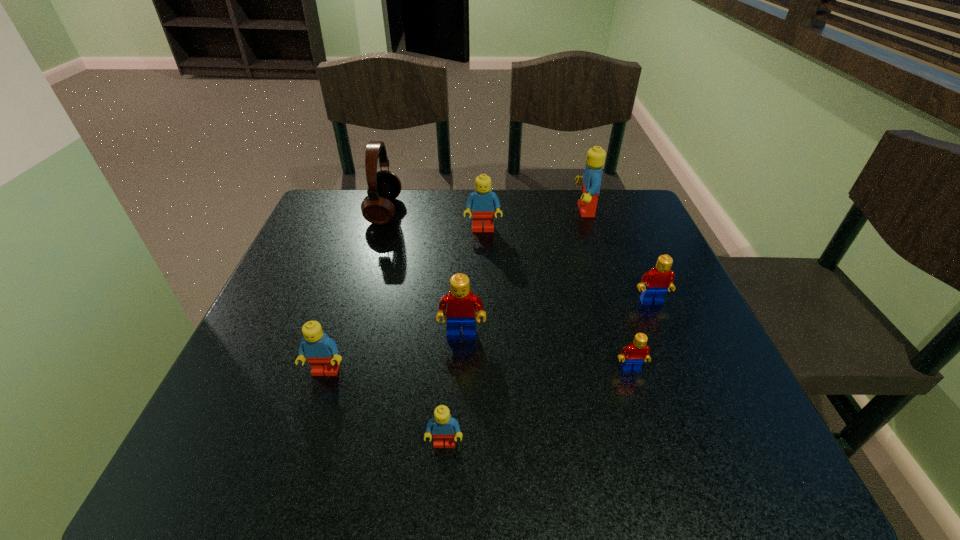
Find the location of a particular element. The height and width of the screenshot is (540, 960). the fifth nearest Lego is located at coordinates (660, 278).

Locate an element on the screen. This screenshot has width=960, height=540. the nearest red Lego is located at coordinates (632, 356).

In order to click on the smallest red Lego in this screenshot , I will do `click(632, 356)`.

Identify the location of the smallest blue Lego. click(443, 426).

You are a GUI agent. You are given a task and a screenshot of the screen. Output one action in this format:
    pyautogui.click(x=<x>, y=<y>)
    Task: Click on the nearest object
    
    Given the screenshot: What is the action you would take?
    tap(443, 426)

This screenshot has width=960, height=540. Identify the location of free space located on the ear pads of the black headset. 516,211.

You are a GUI agent. You are given a task and a screenshot of the screen. Output one action in this format:
    pyautogui.click(x=<x>, y=<y>)
    Task: Click on the vacant space located on the face of the tallest Lego
    The height and width of the screenshot is (540, 960).
    Given the screenshot: What is the action you would take?
    pyautogui.click(x=523, y=211)

Find the location of a particular element. vacant position located 0.090m on the face of the tallest Lego is located at coordinates (541, 211).

You are a GUI agent. You are given a task and a screenshot of the screen. Output one action in this format:
    pyautogui.click(x=<x>, y=<y>)
    Task: Click on the vacant space located on the face of the tallest Lego
    The image size is (960, 540).
    Given the screenshot: What is the action you would take?
    [x=441, y=211]

The image size is (960, 540). I want to click on free point located on the face of the second farthest Lego, so click(484, 315).